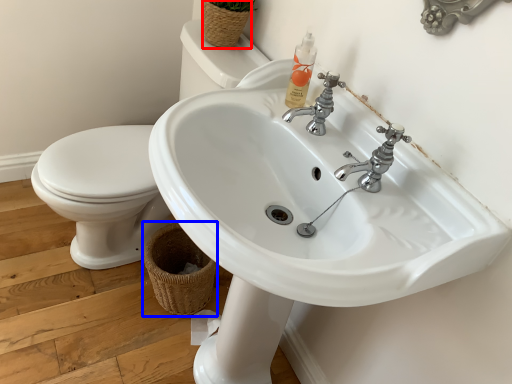
Question: Among these objects, which one is nearest to the camera, basket (highlighted by a red box) or basket (highlighted by a blue box)?

Choices:
 (A) basket
 (B) basket

Answer: (A)